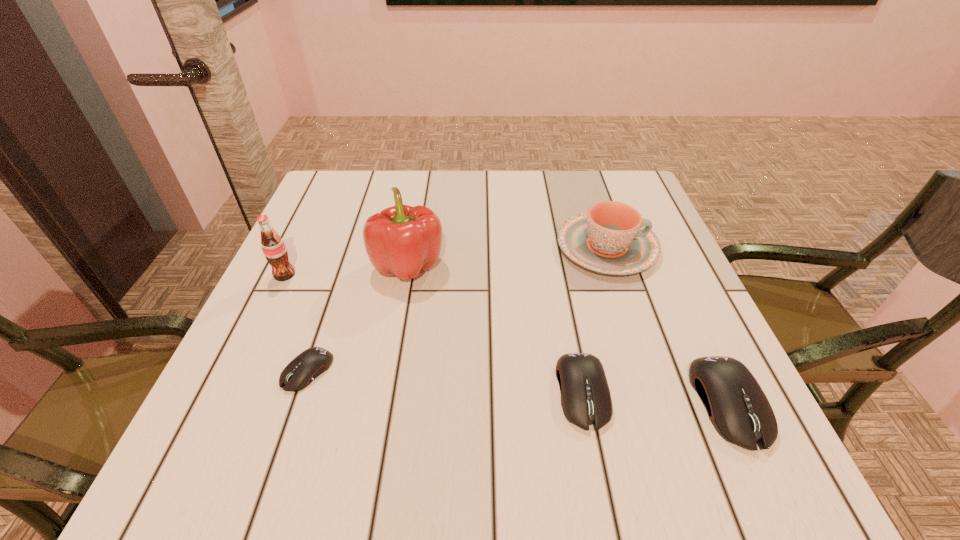
Identify the location of vacant space located on the left of the rightmost computer equipment. (505, 403).

You are a GUI agent. You are given a task and a screenshot of the screen. Output one action in this format:
    pyautogui.click(x=<x>, y=<y>)
    Task: Click on the vacant region located 0.200m on the right of the pepper
    This screenshot has width=960, height=540.
    Given the screenshot: What is the action you would take?
    pyautogui.click(x=534, y=265)

Locate an element on the screen. Image resolution: width=960 pixels, height=540 pixels. vacant space located 0.200m on the front of the leftmost object is located at coordinates (245, 357).

I want to click on object located at the far edge, so point(612,238).

Locate an element on the screen. The image size is (960, 540). computer equipment that is positioned at the left edge is located at coordinates (302, 370).

The height and width of the screenshot is (540, 960). Identify the location of soda that is positioned at the left edge. (273, 247).

At what (x,y) coordinates should I click in order to perform the action: click on computer equipment that is at the right edge. Please return your answer as a coordinate pair (x, y). The image size is (960, 540). Looking at the image, I should click on pos(737,407).

This screenshot has height=540, width=960. Identify the location of chinaware present at the right edge. point(612,238).

Locate an element on the screen. object at the near left corner is located at coordinates (302, 370).

You are a GUI agent. You are given a task and a screenshot of the screen. Output one action in this format:
    pyautogui.click(x=<x>, y=<y>)
    Task: Click on the object that is positioned at the far right corner
    
    Given the screenshot: What is the action you would take?
    pyautogui.click(x=612, y=238)